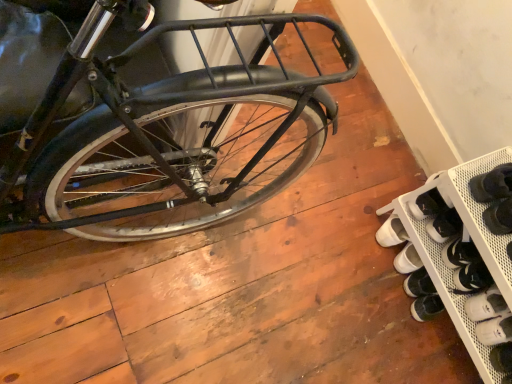
The height and width of the screenshot is (384, 512). What are the coordinates of `free point to the left of white mesh shoe rack at lower right` in the screenshot? It's located at (347, 202).